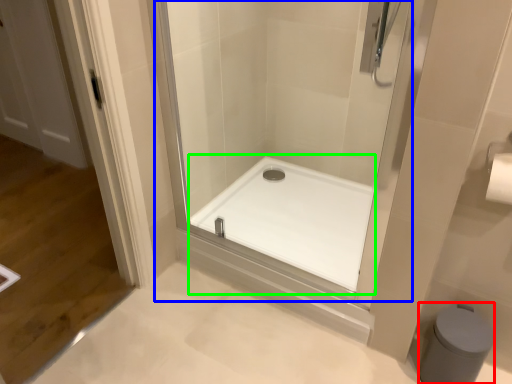
Question: Based on their relative distances, which object is nearer to bidet (highlighted by a red box)? Choose from shower door (highlighted by a blue box) and bath (highlighted by a green box).

Choices:
 (A) shower door
 (B) bath

Answer: (B)